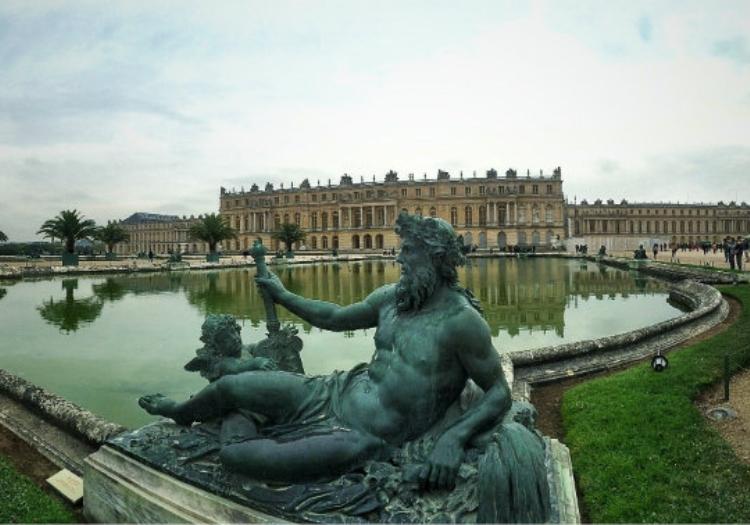
At what (x,y) coordinates should I click in order to perform the action: click on statue. Please return your answer as a coordinate pair (x, y). Looking at the image, I should click on (421, 333).